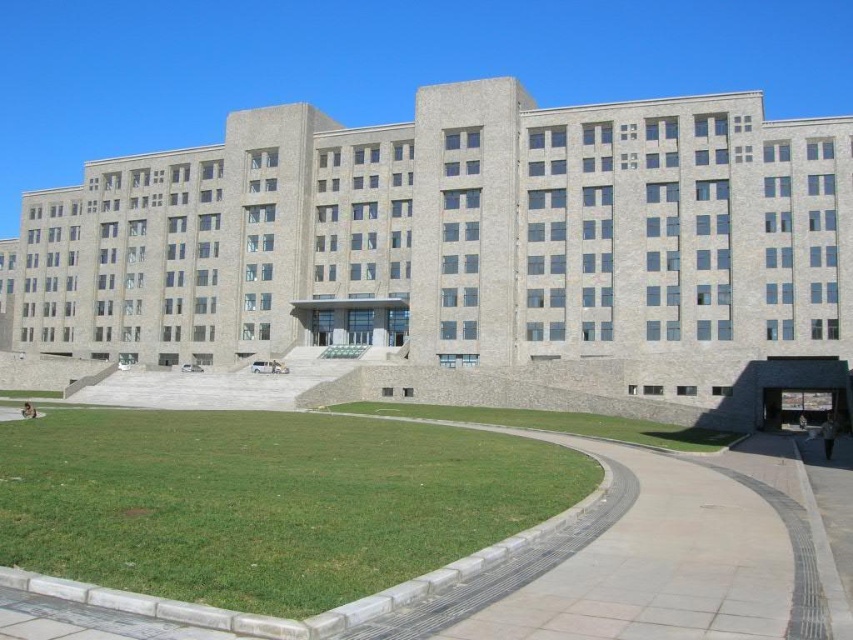
Question: Can you confirm if green grass at lower left is thinner than green grass at lower center?

Choices:
 (A) yes
 (B) no

Answer: (A)

Question: Which point is closer to the camera taking this photo?

Choices:
 (A) (604, 422)
 (B) (180, 579)

Answer: (B)

Question: Does green grass at lower left appear on the right side of green grass at lower center?

Choices:
 (A) no
 (B) yes

Answer: (A)

Question: Can you confirm if green grass at lower left is positioned below green grass at lower center?

Choices:
 (A) yes
 (B) no

Answer: (B)

Question: Which of the following is the closest to the observer?

Choices:
 (A) (689, 448)
 (B) (321, 426)

Answer: (A)